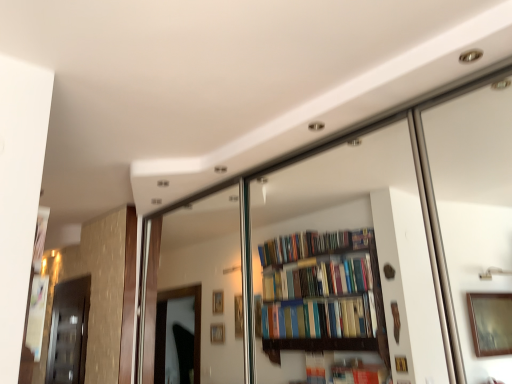
The image size is (512, 384). What do you see at coordinates (69, 332) in the screenshot?
I see `transparent glass screen door at left` at bounding box center [69, 332].

Image resolution: width=512 pixels, height=384 pixels. What are the coordinates of `transparent glass screen door at left` in the screenshot? It's located at (69, 332).

Image resolution: width=512 pixels, height=384 pixels. I want to click on transparent glass screen door at left, so click(x=69, y=332).